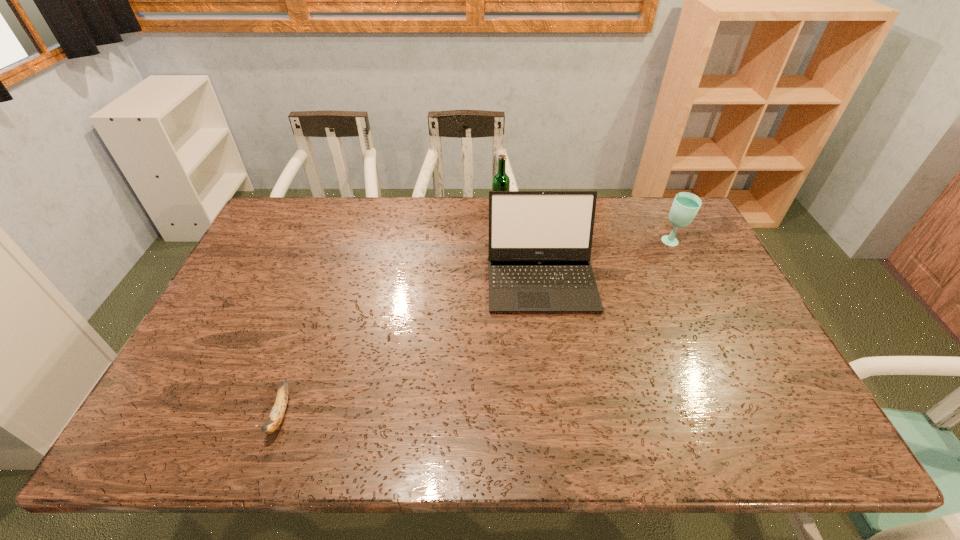
Image resolution: width=960 pixels, height=540 pixels. Find the location of `glass at the far edge`. glass at the far edge is located at coordinates (685, 206).

I want to click on object present at the near edge, so click(x=278, y=410).

Find the location of a particular element. This screenshot has width=960, height=540. object at the right edge is located at coordinates (685, 206).

This screenshot has height=540, width=960. In order to click on object located in the far right corner section of the desktop in this screenshot , I will do `click(685, 206)`.

Find the location of a particular element. The height and width of the screenshot is (540, 960). free region at the far edge of the desktop is located at coordinates pyautogui.click(x=408, y=226).

This screenshot has height=540, width=960. In order to click on free point at the near edge in this screenshot , I will do `click(408, 429)`.

You are a GUI agent. You are given a task and a screenshot of the screen. Output one action in this format:
    pyautogui.click(x=<x>, y=<y>)
    Task: Click on the vacant space at the left edge of the desktop
    The height and width of the screenshot is (540, 960).
    Given the screenshot: What is the action you would take?
    point(267,284)

Locate an element on the screen. This screenshot has width=960, height=540. vacant space at the right edge is located at coordinates (692, 298).

Locate an element on the screen. Image resolution: width=960 pixels, height=540 pixels. vacant space at the far right corner is located at coordinates (661, 222).

Locate an element on the screen. vacant area at the near right corner of the desktop is located at coordinates (749, 437).